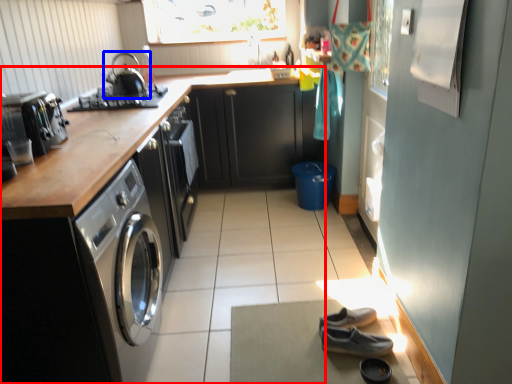
Question: Which of the following is the closest to the observer, cabinetry (highlighted by a red box) or kitchen appliance (highlighted by a blue box)?

Choices:
 (A) cabinetry
 (B) kitchen appliance

Answer: (A)